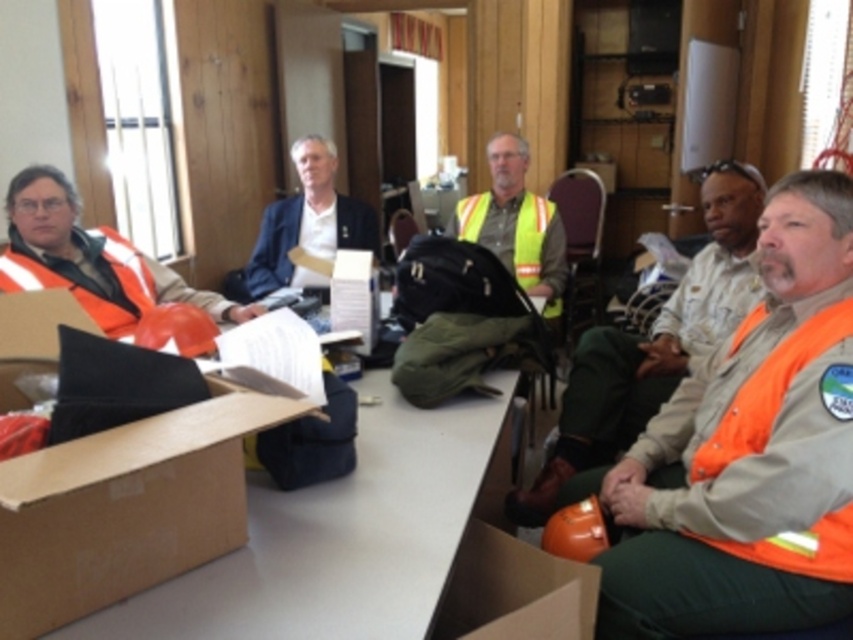
You are standing in the room and want to pick up an object. There are two points marked in the image. The first point is at coordinate point (x=132, y=577) and the second point is at coordinate point (x=86, y=253). Which point is closer to you?

Point (x=132, y=577) is closer to the camera than point (x=86, y=253), so the first point is closer to you.

You are an observer in the room where the meeting is taking place. You notice the orange reflective vest at left and the matte blue jacket at center. Which object is closer to the floor?

The orange reflective vest at left is positioned under the matte blue jacket at center, so it is closer to the floor.